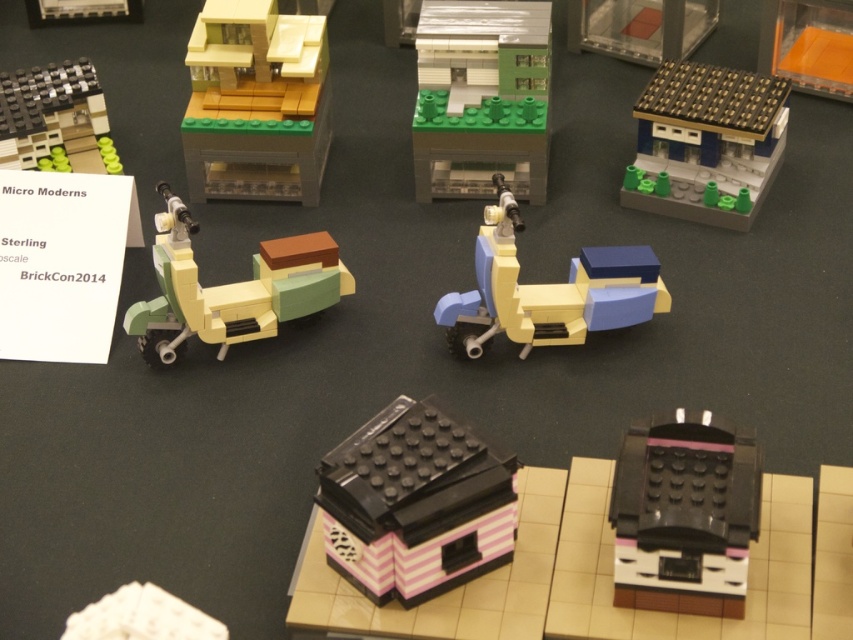
Can you confirm if pink striped plastic house at center is positioned to the left of matte plastic scooter at center?

Yes, pink striped plastic house at center is to the left of matte plastic scooter at center.

Is pink striped plastic house at center wider than matte plastic scooter at center?

Incorrect, pink striped plastic house at center's width does not surpass matte plastic scooter at center's.

Is point (430, 422) farther from viewer compared to point (579, 257)?

No.

I want to click on pink striped plastic house at center, so click(x=415, y=504).

Which is above, pink striped plastic house at center or white matte cube at lower left?

pink striped plastic house at center is above.

Does point (444, 506) lie behind point (125, 637)?

Yes.

Identify the location of pink striped plastic house at center. This screenshot has width=853, height=640. pos(415,504).

Can you confirm if light brown matte building at upper left is thinner than matte black building at upper left?

In fact, light brown matte building at upper left might be wider than matte black building at upper left.

Who is positioned more to the left, light brown matte building at upper left or matte black building at upper left?

From the viewer's perspective, matte black building at upper left appears more on the left side.

Does point (318, 131) lie in front of point (78, 152)?

No.

This screenshot has width=853, height=640. I want to click on light brown matte building at upper left, so click(256, 104).